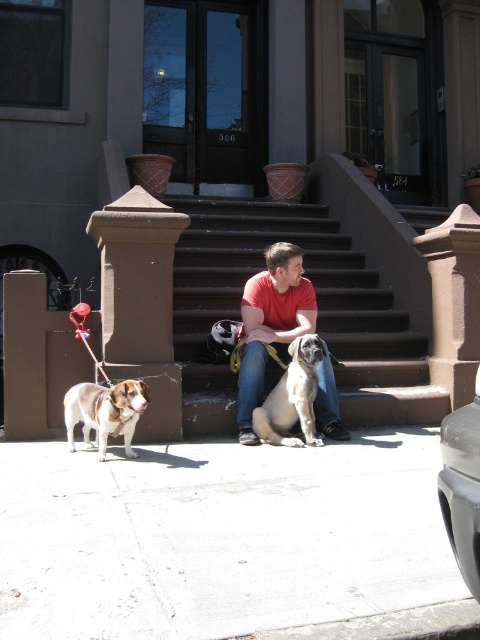
Question: Can you confirm if white concrete pavement at lower center is positioned below red matte shirt at center?

Choices:
 (A) no
 (B) yes

Answer: (B)

Question: Can you confirm if white concrete pavement at lower center is positioned above white and brown fur at lower left?

Choices:
 (A) no
 (B) yes

Answer: (A)

Question: Where is brown stone stairs at center located in relation to smooth gray dog at center in the image?

Choices:
 (A) right
 (B) left

Answer: (B)

Question: Which point is closer to the camera?

Choices:
 (A) (139, 193)
 (B) (252, 410)
 (C) (63, 417)

Answer: (B)

Question: Among these points, which one is farthest from the camera?

Choices:
 (A) (371, 381)
 (B) (309, 342)
 (C) (300, 248)

Answer: (A)

Question: Among these points, which one is nearest to the camera?

Choices:
 (A) (307, 392)
 (B) (255, 442)
 (C) (3, 580)

Answer: (C)